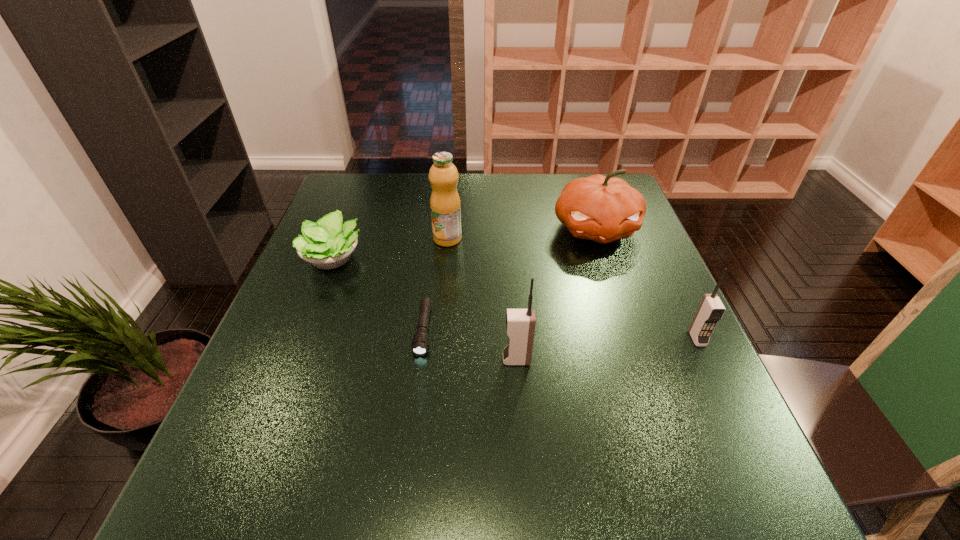
Find the location of `vacant area between the pumpkin and the nearer cellular telephone`. vacant area between the pumpkin and the nearer cellular telephone is located at coordinates (556, 294).

Image resolution: width=960 pixels, height=540 pixels. I want to click on free point between the flashlight and the shorter cellular telephone, so click(561, 335).

This screenshot has width=960, height=540. Find the location of `vacant area that lies between the pumpkin and the left cellular telephone`. vacant area that lies between the pumpkin and the left cellular telephone is located at coordinates (556, 294).

In order to click on free space between the shortest object and the third object from right to left in this screenshot , I will do pos(470,345).

This screenshot has height=540, width=960. What are the coordinates of `vacant point located between the pumpkin and the shortest object` in the screenshot? It's located at (510, 280).

Locate an element on the screen. free space between the fifth object from left to right and the nearer cellular telephone is located at coordinates (556, 294).

Locate an element on the screen. This screenshot has height=540, width=960. vacant region between the shortest object and the taller cellular telephone is located at coordinates (470, 345).

Point out which object is positioned as the nearest to the fruit juice. Please provide its 2D coordinates. Your answer should be formatted as a tuple, i.e. [(x, y)], where the tuple contains the x and y coordinates of a point satisfying the conditions above.

[(327, 244)]

Select which object is the third closest to the pumpkin. Please provide its 2D coordinates. Your answer should be formatted as a tuple, i.e. [(x, y)], where the tuple contains the x and y coordinates of a point satisfying the conditions above.

[(520, 323)]

Where is `free space that satisfies the following two spatial constraints: 1. on the front face of the fifth object from left to right; 2. on the front-facing side of the third object from right to left`? The width and height of the screenshot is (960, 540). free space that satisfies the following two spatial constraints: 1. on the front face of the fifth object from left to right; 2. on the front-facing side of the third object from right to left is located at coordinates (639, 360).